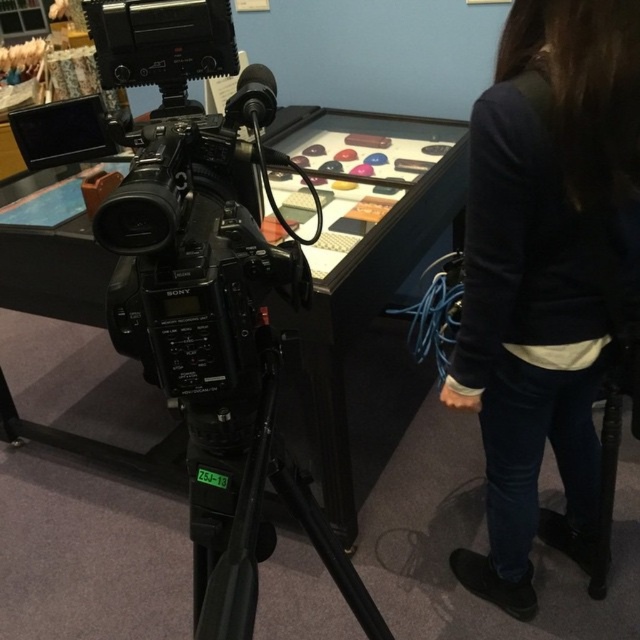
Question: Can you confirm if dark blue sweater at upper right is positioned above black matte tripod at center?

Choices:
 (A) yes
 (B) no

Answer: (A)

Question: Can you confirm if dark blue sweater at upper right is positioned to the right of black matte tripod at center?

Choices:
 (A) yes
 (B) no

Answer: (A)

Question: Which point appears closest to the camera in this image?

Choices:
 (A) (257, 481)
 (B) (621, 118)

Answer: (A)

Question: Can you confirm if dark blue sweater at upper right is smaller than black matte tripod at center?

Choices:
 (A) no
 (B) yes

Answer: (A)

Question: Among these objects, which one is nearest to the camera?

Choices:
 (A) dark blue sweater at upper right
 (B) black matte tripod at center

Answer: (B)